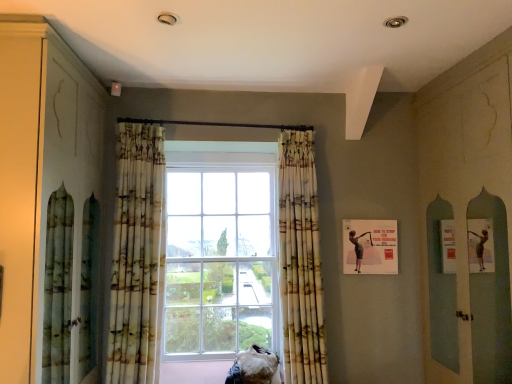
Question: Is printed fabric curtain at center, which is the 1th curtain from right to left, far from matte paper poster at right?

Choices:
 (A) no
 (B) yes

Answer: (A)

Question: Does printed fabric curtain at center, the second curtain in the left-to-right sequence, touch matte paper poster at right?

Choices:
 (A) yes
 (B) no

Answer: (B)

Question: Is printed fabric curtain at center, the second curtain in the left-to-right sequence, positioned before matte paper poster at right?

Choices:
 (A) no
 (B) yes

Answer: (B)

Question: Can you confirm if printed fabric curtain at center, which is the 1th curtain from right to left, is taller than matte paper poster at right?

Choices:
 (A) yes
 (B) no

Answer: (A)

Question: Considering the relative sizes of printed fabric curtain at center, the second curtain in the left-to-right sequence, and matte paper poster at right in the image provided, is printed fabric curtain at center, the second curtain in the left-to-right sequence, shorter than matte paper poster at right?

Choices:
 (A) no
 (B) yes

Answer: (A)

Question: From the image's perspective, is matte paper poster at right above or below matte green cabinet at left?

Choices:
 (A) above
 (B) below

Answer: (B)

Question: Is matte paper poster at right bigger or smaller than matte green cabinet at left?

Choices:
 (A) big
 (B) small

Answer: (B)

Question: Do you think matte paper poster at right is within matte green cabinet at left, or outside of it?

Choices:
 (A) inside
 (B) outside

Answer: (B)

Question: Is matte paper poster at right taller or shorter than matte green cabinet at left?

Choices:
 (A) tall
 (B) short

Answer: (B)

Question: Is point (115, 258) positioned closer to the camera than point (286, 215)?

Choices:
 (A) farther
 (B) closer

Answer: (B)

Question: Looking at the image, does printed fabric curtain at center, which ranks as the 2th curtain in right-to-left order, seem bigger or smaller compared to printed fabric curtain at center, the second curtain in the left-to-right sequence?

Choices:
 (A) small
 (B) big

Answer: (B)

Question: Considering the positions of printed fabric curtain at center, marked as the first curtain in a left-to-right arrangement, and printed fabric curtain at center, the second curtain in the left-to-right sequence, in the image, is printed fabric curtain at center, marked as the first curtain in a left-to-right arrangement, wider or thinner than printed fabric curtain at center, the second curtain in the left-to-right sequence,?

Choices:
 (A) wide
 (B) thin

Answer: (B)

Question: From the image's perspective, relative to printed fabric curtain at center, the second curtain in the left-to-right sequence, is printed fabric curtain at center, which ranks as the 2th curtain in right-to-left order, above or below?

Choices:
 (A) above
 (B) below

Answer: (A)

Question: Considering the positions of printed fabric curtain at center, the second curtain in the left-to-right sequence, and matte paper poster at right in the image, is printed fabric curtain at center, the second curtain in the left-to-right sequence, taller or shorter than matte paper poster at right?

Choices:
 (A) tall
 (B) short

Answer: (A)

Question: From the image's perspective, is printed fabric curtain at center, which is the 1th curtain from right to left, located above or below matte paper poster at right?

Choices:
 (A) below
 (B) above

Answer: (A)